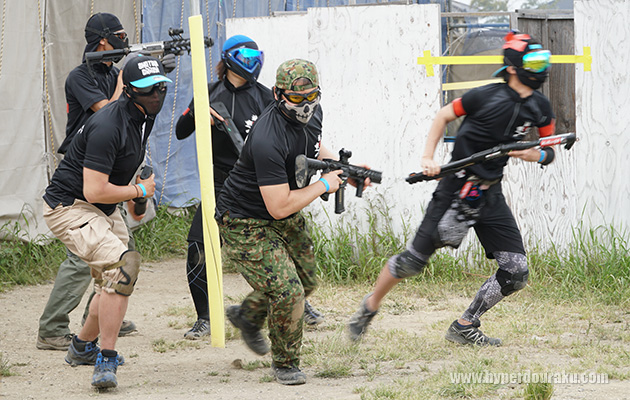
Identify the location of white wall. (368, 81).